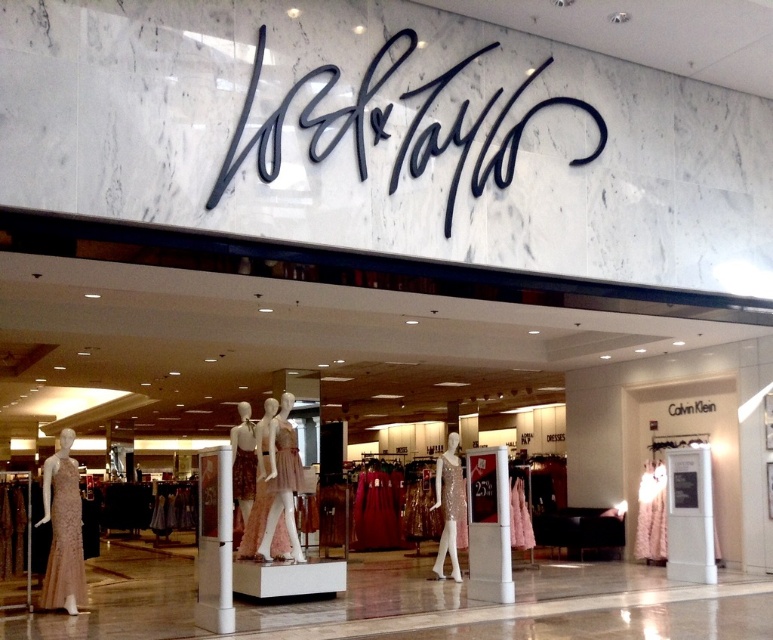
You are standing at the entrance of the Nordstrom store and want to reach the point marked as point (642, 480). However, there is an obstacle at point (444, 456). Can you walk directly to your destination without going around the obstacle?

Point (642, 480) is behind point (444, 456), so you cannot walk directly to point (642, 480) without going around the obstacle at point (444, 456).

You are a customer looking at the dresses displayed in the Nordstrom store entrance. You see the shiny gold dress at right and the sparkly gold dress at center. Which dress is positioned more to the right side of the display?

The shiny gold dress at right is positioned more to the right side of the display compared to the sparkly gold dress at center, as it is located to the right of it.